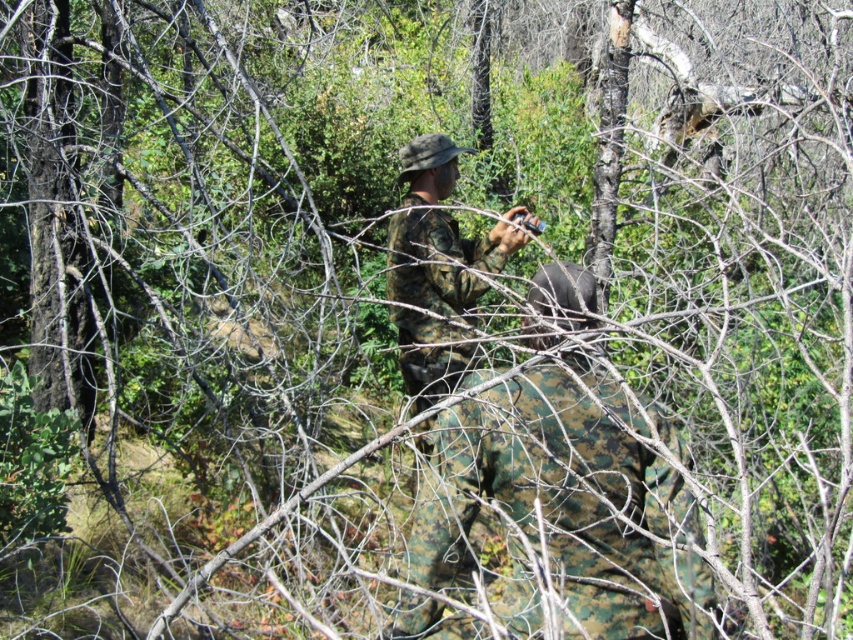
Can you confirm if camo fabric uniform at center is shorter than camouflage fabric uniform at center?

Yes, camo fabric uniform at center is shorter than camouflage fabric uniform at center.

At what (x,y) coordinates should I click in order to perform the action: click on camo fabric uniform at center. Please return your answer as a coordinate pair (x, y). The height and width of the screenshot is (640, 853). Looking at the image, I should click on (563, 502).

This screenshot has height=640, width=853. I want to click on camo fabric uniform at center, so click(x=563, y=502).